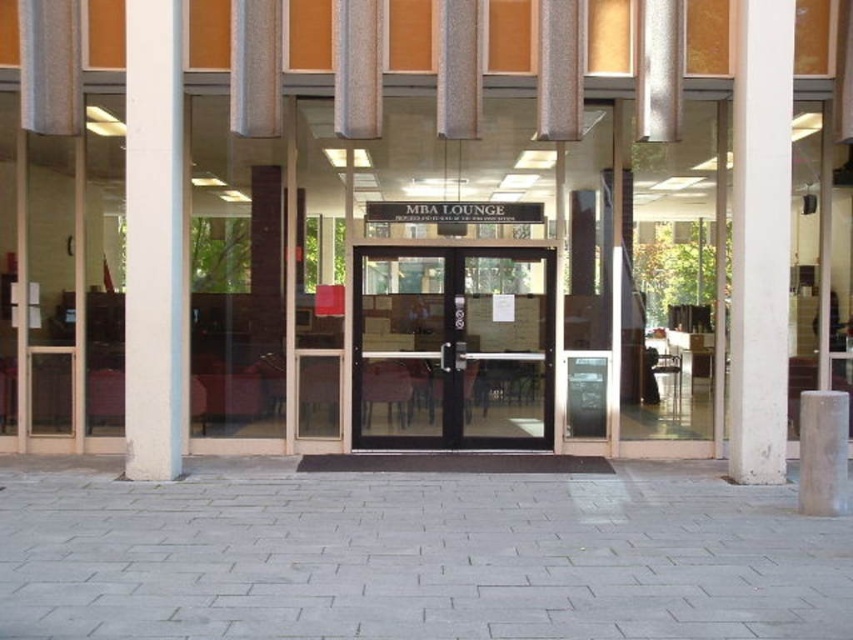
Question: Observing the image, what is the correct spatial positioning of transparent glass door at center in reference to white concrete pillar at right?

Choices:
 (A) above
 (B) below

Answer: (B)

Question: Does white concrete pillar at right have a larger size compared to white concrete pillar at left?

Choices:
 (A) yes
 (B) no

Answer: (B)

Question: Which point is closer to the camera?

Choices:
 (A) (490, 365)
 (B) (728, 416)

Answer: (B)

Question: Among these points, which one is nearest to the camera?

Choices:
 (A) coord(770,296)
 (B) coord(433,449)
 (C) coord(173,332)

Answer: (A)

Question: Estimate the real-world distances between objects in this image. Which object is closer to the transparent glass door at center?

Choices:
 (A) white concrete pillar at left
 (B) white concrete pillar at right

Answer: (A)

Question: Does white concrete pillar at right appear over white concrete pillar at left?

Choices:
 (A) yes
 (B) no

Answer: (A)